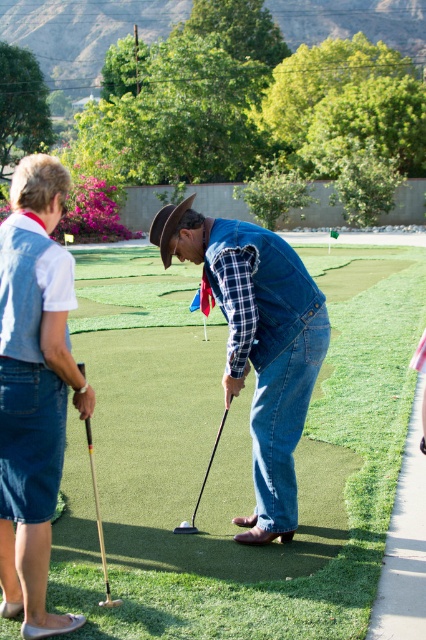
You are standing at the point with coordinates point (210, 481) and want to take a photo of the entire miniature golf course. If your camera has a maximum range of 5 meters, will you be able to capture the entire scene in one shot?

The distance between point (210, 481) and the camera is 5.86 meters, which exceeds the camera maximum range of 5 meters. Therefore, you will not be able to capture the entire scene in one shot.